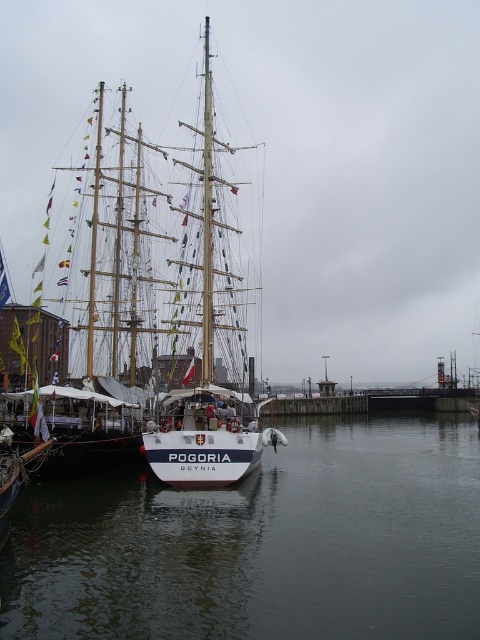
Question: Can you confirm if clear water at center is thinner than white matte sailboat at center?

Choices:
 (A) no
 (B) yes

Answer: (A)

Question: Is clear water at center to the right of white matte sailboat at center from the viewer's perspective?

Choices:
 (A) yes
 (B) no

Answer: (A)

Question: Which point is farther to the camera?

Choices:
 (A) (242, 419)
 (B) (15, 620)

Answer: (A)

Question: Which of the following is the farthest from the observer?

Choices:
 (A) clear water at center
 (B) white matte sailboat at center

Answer: (B)

Question: Is clear water at center above white matte sailboat at center?

Choices:
 (A) yes
 (B) no

Answer: (B)

Question: Which point appears farthest from the camera in this image?

Choices:
 (A) (474, 438)
 (B) (216, 387)

Answer: (A)